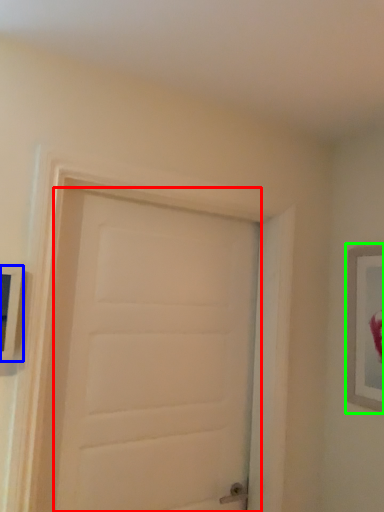
Question: Which object is positioned farthest from door (highlighted by a red box)? Select from picture frame (highlighted by a blue box) and picture frame (highlighted by a green box).

Choices:
 (A) picture frame
 (B) picture frame

Answer: (B)